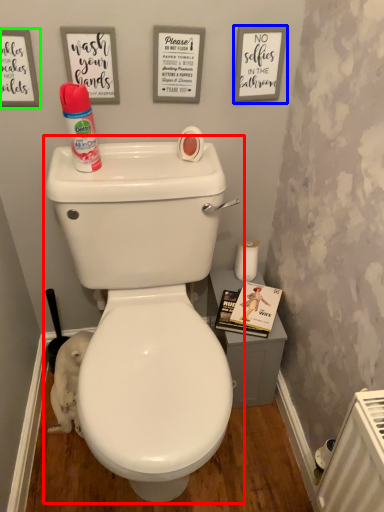
Question: Based on their relative distances, which object is nearer to toilet (highlighted by a red box)? Choose from copy (highlighted by a blue box) and copy (highlighted by a green box).

Choices:
 (A) copy
 (B) copy

Answer: (B)